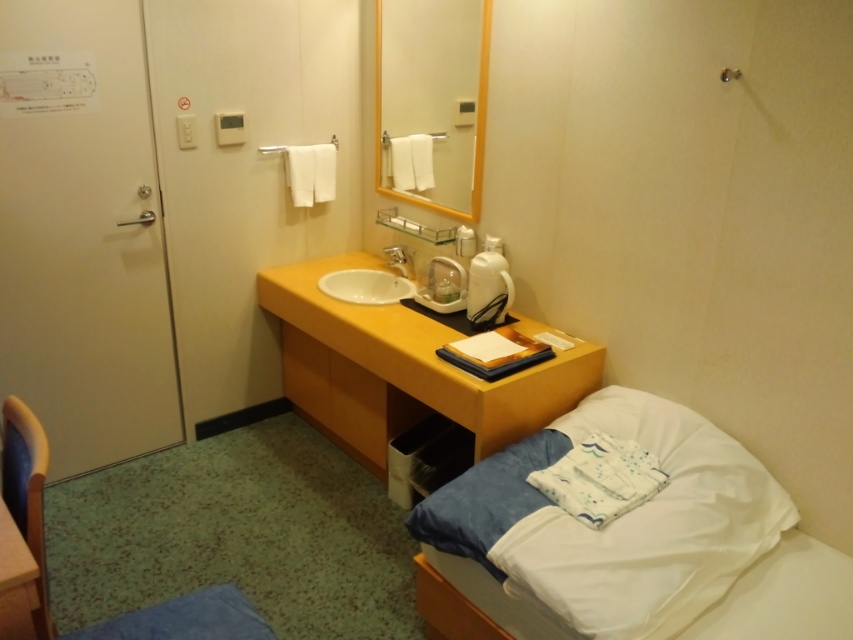
The width and height of the screenshot is (853, 640). What do you see at coordinates (401, 369) in the screenshot? I see `yellow matte vanity at center` at bounding box center [401, 369].

Locate an element on the screen. The width and height of the screenshot is (853, 640). yellow matte vanity at center is located at coordinates (401, 369).

At what (x,y) coordinates should I click in order to perform the action: click on yellow matte vanity at center. Please return your answer as a coordinate pair (x, y). Looking at the image, I should click on (401, 369).

Is point (578, 381) more distant than point (393, 257)?

No, (578, 381) is closer to viewer.

Identify the location of yellow matte vanity at center. The image size is (853, 640). (401, 369).

Who is positioned more to the right, yellow-framed mirror at upper center or silver metallic faucet at center?

yellow-framed mirror at upper center

What do you see at coordinates (432, 100) in the screenshot? I see `yellow-framed mirror at upper center` at bounding box center [432, 100].

Where is `yellow-framed mirror at upper center`? yellow-framed mirror at upper center is located at coordinates (432, 100).